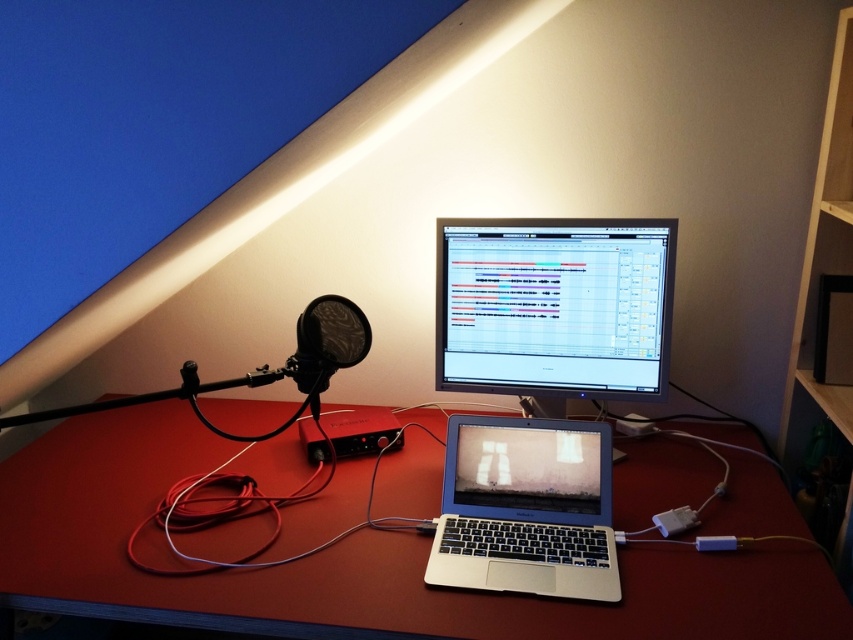
Describe the element at coordinates (351, 561) in the screenshot. The image size is (853, 640). I see `smooth wooden desk at center` at that location.

Is point (677, 579) closer to viewer compared to point (296, 337)?

Yes, point (677, 579) is in front of point (296, 337).

Which is behind, point (433, 461) or point (346, 324)?

Positioned behind is point (433, 461).

Image resolution: width=853 pixels, height=640 pixels. Identify the location of smooth wooden desk at center. (351, 561).

Is silver metallic laptop at center wider than matte black microphone at left?

Correct, the width of silver metallic laptop at center exceeds that of matte black microphone at left.

Which is behind, point (556, 460) or point (309, 340)?

The point (556, 460) is behind.

Where is `silver metallic laptop at center`? The image size is (853, 640). silver metallic laptop at center is located at coordinates (526, 508).

This screenshot has height=640, width=853. I want to click on silver metallic laptop at center, so click(x=526, y=508).

Describe the element at coordinates (554, 307) in the screenshot. I see `matte black monitor at center` at that location.

Who is more forward, [480,346] or [321,332]?

Point [321,332] is in front.

The width and height of the screenshot is (853, 640). I want to click on matte black monitor at center, so click(554, 307).